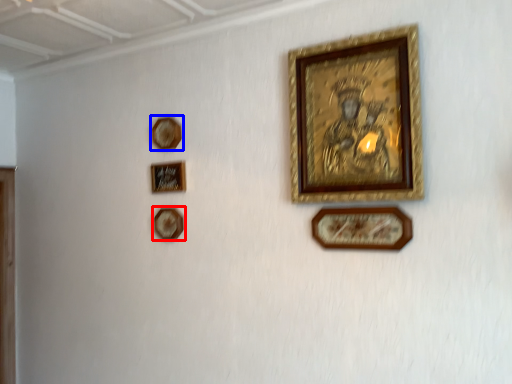
Question: Which point is closer to the camera, picture frame (highlighted by a red box) or picture frame (highlighted by a blue box)?

Choices:
 (A) picture frame
 (B) picture frame

Answer: (B)